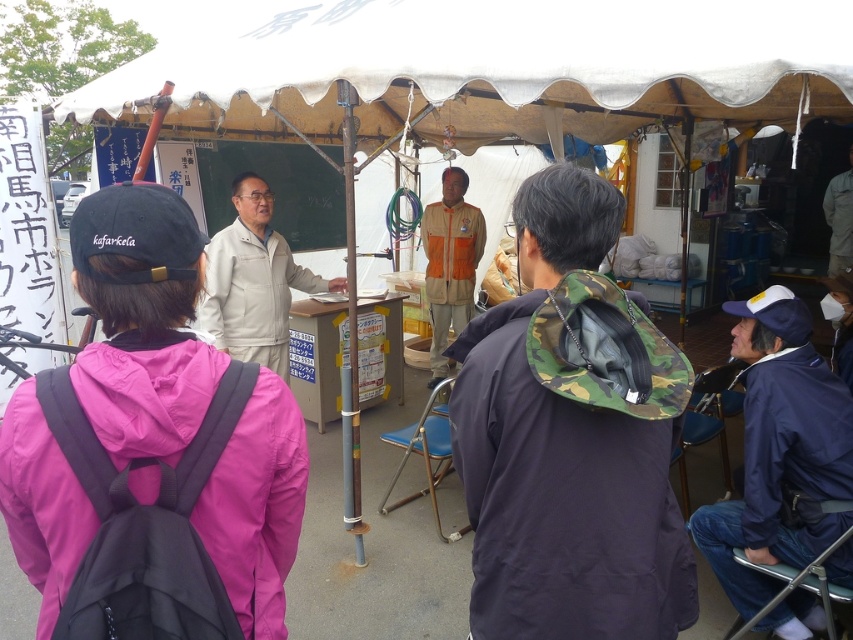
Question: Can you confirm if white fabric canopy at upper center is positioned to the left of beige fabric jacket at center?

Choices:
 (A) no
 (B) yes

Answer: (A)

Question: Which of the following is the closest to the observer?

Choices:
 (A) (564, 32)
 (B) (614, 284)

Answer: (B)

Question: Does camo jacket at center appear on the right side of navy blue jacket at lower right?

Choices:
 (A) yes
 (B) no

Answer: (B)

Question: Which object appears farthest from the camera in this image?

Choices:
 (A) camo jacket at center
 (B) navy blue jacket at lower right
 (C) orange fabric shirt at center
 (D) beige fabric jacket at center

Answer: (C)

Question: Is the position of camo jacket at center more distant than that of beige fabric jacket at center?

Choices:
 (A) yes
 (B) no

Answer: (B)

Question: Estimate the real-world distances between objects in this image. Which object is farther from the orange fabric shirt at center?

Choices:
 (A) white fabric canopy at upper center
 (B) navy blue jacket at lower right

Answer: (B)